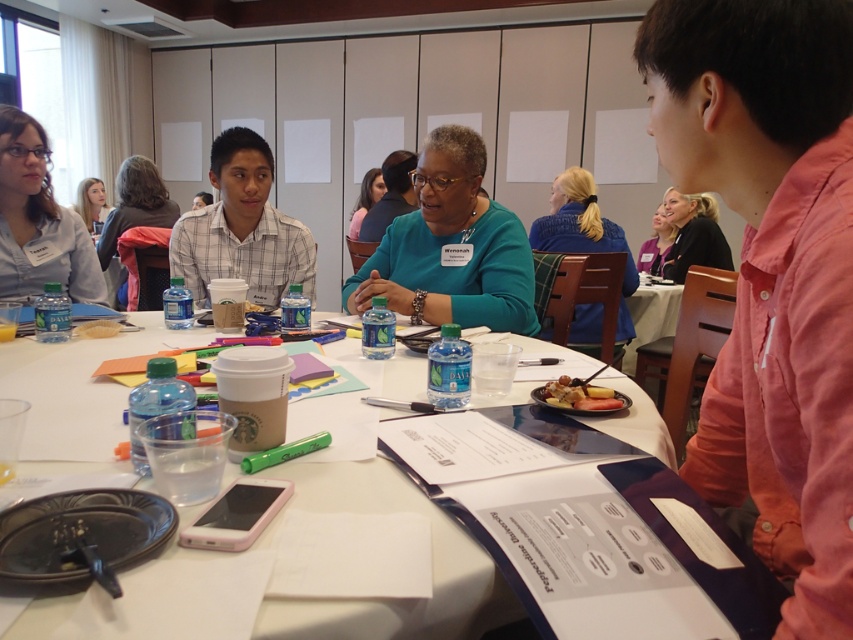
You are a participant in the meeting and need to place a new folder on the table. Considering the height difference between the white plastic table at center and the translucent plastic bag at table center, which object should you place the folder on to ensure it stays stable?

The white plastic table at center is much taller than the translucent plastic bag at table center, so placing the folder on the white plastic table at center would ensure stability.

You are sitting at the table and want to reach both the blue knit sweater at center and the smooth brown bread at center. Which item is closer to your left hand?

The smooth brown bread at center is closer to your left hand because the blue knit sweater at center is positioned to its right.